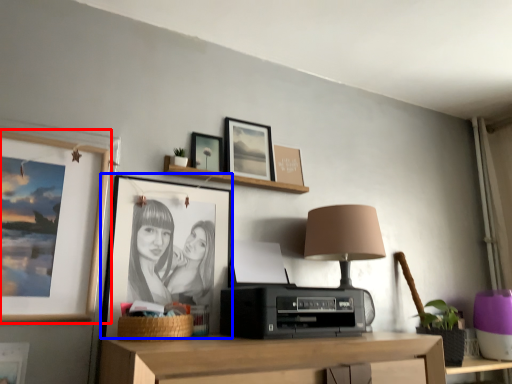
Question: Which object is further to the camera taking this photo, picture frame (highlighted by a red box) or picture frame (highlighted by a blue box)?

Choices:
 (A) picture frame
 (B) picture frame

Answer: (B)